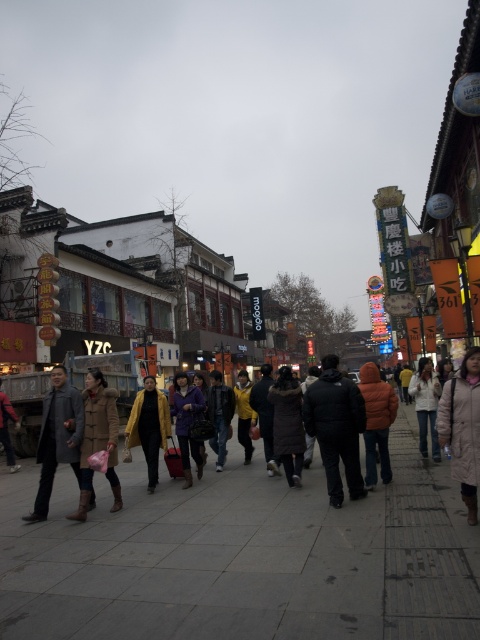
Does dark gray coat at center come in front of orange puffy jacket at center?

Yes, it is in front of orange puffy jacket at center.

Does dark gray coat at center have a lesser width compared to orange puffy jacket at center?

No, dark gray coat at center is not thinner than orange puffy jacket at center.

Who is more distant from viewer, (51, 376) or (373, 406)?

Point (373, 406)

This screenshot has width=480, height=640. Find the location of `dark gray coat at center`. dark gray coat at center is located at coordinates (87, 368).

Who is lower down, dark gray coat at center or yellow matte coat at center?

dark gray coat at center is below.

Identify the location of dark gray coat at center. The height and width of the screenshot is (640, 480). (87, 368).

Between point (317, 417) and point (12, 465), which one is positioned in front?

Point (317, 417) is more forward.

Looking at this image, does black matte jacket at center lie in front of brown leather jacket at lower left?

Yes, black matte jacket at center is in front of brown leather jacket at lower left.

Which is behind, point (326, 477) or point (3, 436)?

The point (3, 436) is more distant.

Where is `black matte jacket at center`? The height and width of the screenshot is (640, 480). black matte jacket at center is located at coordinates (336, 428).